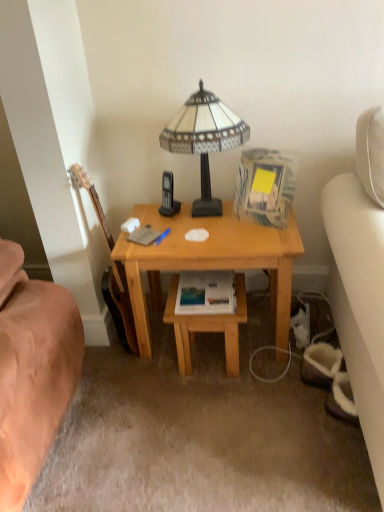
Question: From a real-world perspective, is wooden acoustic guitar at left positioned above or below wooden desk at center?

Choices:
 (A) above
 (B) below

Answer: (A)

Question: In terms of size, does wooden acoustic guitar at left appear bigger or smaller than wooden desk at center?

Choices:
 (A) big
 (B) small

Answer: (B)

Question: Estimate the real-world distances between objects in this image. Which object is farther from the stained glass lampshade at center?

Choices:
 (A) light brown wood table at center
 (B) wooden desk at center
 (C) wooden acoustic guitar at left
 (D) matte paper paperback book at center

Answer: (A)

Question: Which is nearer to the matte paper paperback book at center?

Choices:
 (A) stained glass lampshade at center
 (B) wooden acoustic guitar at left
 (C) wooden desk at center
 (D) light brown wood table at center

Answer: (D)